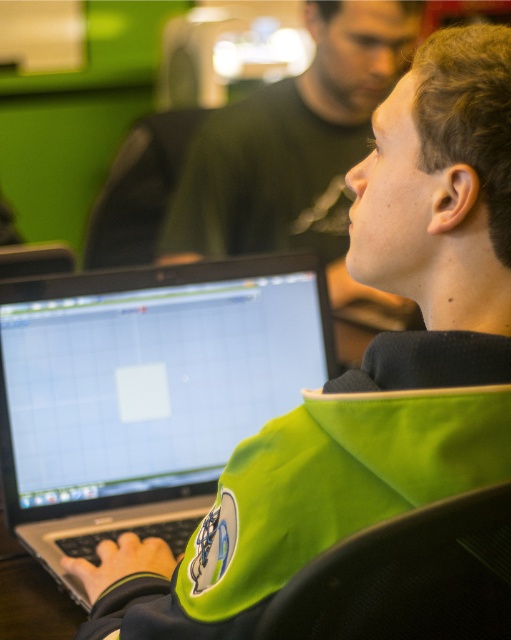
Question: Observing the image, what is the correct spatial positioning of silver metallic laptop at center in reference to green matte jacket at upper center?

Choices:
 (A) below
 (B) above

Answer: (A)

Question: In this image, where is silver metallic laptop at center located relative to green matte jacket at upper center?

Choices:
 (A) below
 (B) above

Answer: (A)

Question: Which of the following is the farthest from the observer?

Choices:
 (A) silver metallic laptop at center
 (B) green matte jacket at upper center

Answer: (B)

Question: Which point is farther to the camera?

Choices:
 (A) (399, 35)
 (B) (191, 490)

Answer: (A)

Question: Is silver metallic laptop at center in front of green matte jacket at upper center?

Choices:
 (A) yes
 (B) no

Answer: (A)